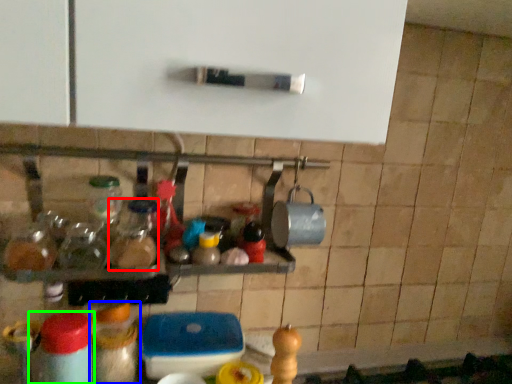
Question: Which is nearer to the bottle (highlighted by a red box)? bottle (highlighted by a blue box) or bottle (highlighted by a green box).

Choices:
 (A) bottle
 (B) bottle

Answer: (A)